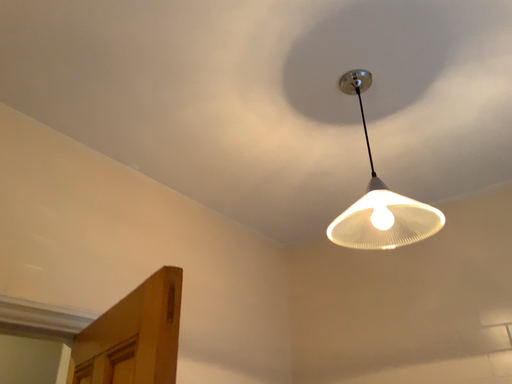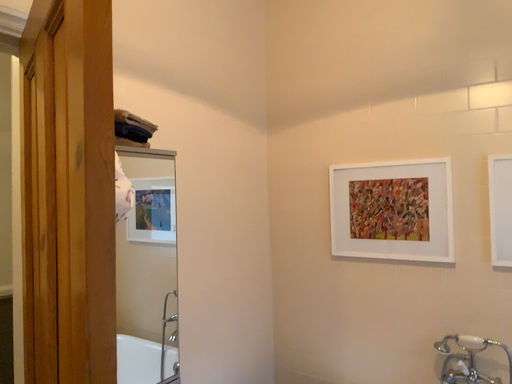
Question: How did the camera likely rotate when shooting the video?

Choices:
 (A) rotated upward
 (B) rotated downward

Answer: (B)